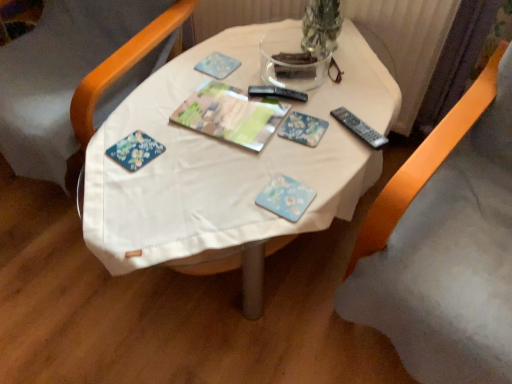
Where is `vacant space that is to the left of floral-patterned paper at center, positioned as the first paperback book in back-to-front order`? The image size is (512, 384). vacant space that is to the left of floral-patterned paper at center, positioned as the first paperback book in back-to-front order is located at coordinates (240, 125).